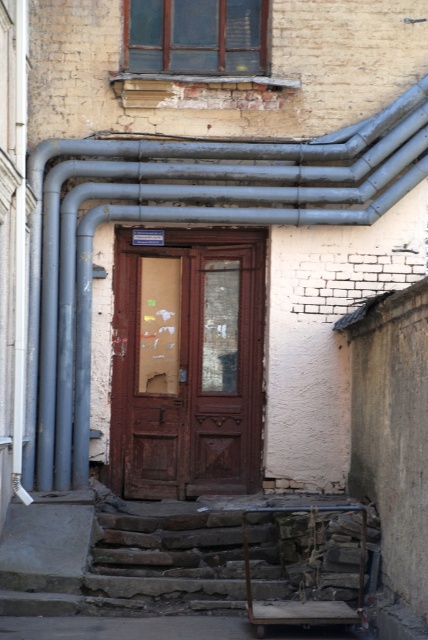
Can you confirm if metallic gray pipes at upper left is positioned above brown wooden door at center?

Yes.

Between metallic gray pipes at upper left and brown wooden door at center, which one appears on the left side from the viewer's perspective?

metallic gray pipes at upper left

Locate an element on the screen. This screenshot has height=640, width=428. metallic gray pipes at upper left is located at coordinates (181, 221).